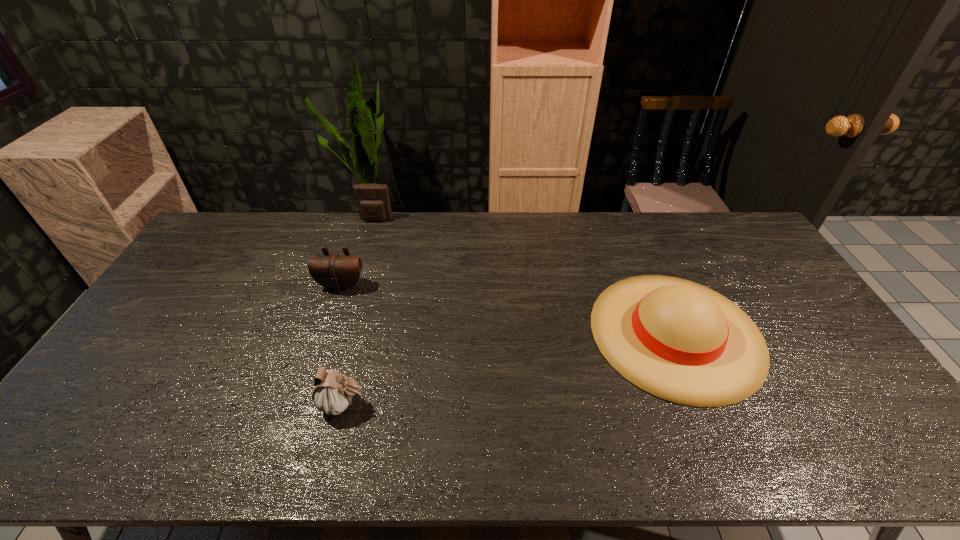
Select which pouch appears as the second closest to the farthest pouch. Please provide its 2D coordinates. Your answer should be formatted as a tuple, i.e. [(x, y)], where the tuple contains the x and y coordinates of a point satisfying the conditions above.

[(333, 392)]

The width and height of the screenshot is (960, 540). What are the coordinates of `free space that satisfies the following two spatial constraints: 1. with the flap open on the rightmost object; 2. on the right side of the second nearest pouch` in the screenshot? It's located at (325, 333).

Find the location of a particular element. The image size is (960, 540). vacant space that satisfies the following two spatial constraints: 1. with an open flap on the farthest pouch; 2. on the right side of the sombrero is located at coordinates (343, 333).

What are the coordinates of `free spot that satisfies the following two spatial constraints: 1. with the flap open on the sombrero; 2. on the right side of the second nearest pouch` in the screenshot? It's located at (325, 333).

You are a GUI agent. You are given a task and a screenshot of the screen. Output one action in this format:
    pyautogui.click(x=<x>, y=<y>)
    Task: Click on the vacant space that satisfies the following two spatial constraints: 1. with an open flap on the farthest pouch; 2. on the left side of the sombrero
    The height and width of the screenshot is (540, 960).
    Given the screenshot: What is the action you would take?
    pyautogui.click(x=343, y=333)